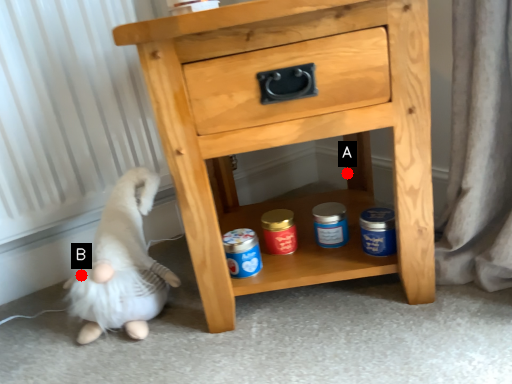
Question: Two points are circled on the image, labeled by A and B beside each circle. Which point is closer to the camera?

Choices:
 (A) A is closer
 (B) B is closer

Answer: (B)